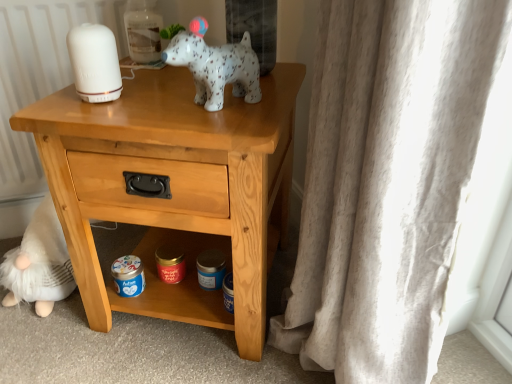
Identify the location of free point in front of white speckled ceramic dog at upper center. The width and height of the screenshot is (512, 384). (212, 124).